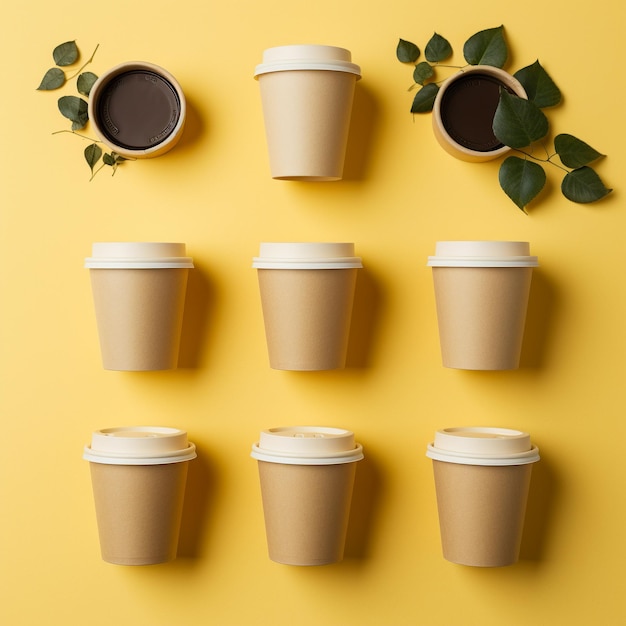
Where is `cup lid`? The width and height of the screenshot is (626, 626). cup lid is located at coordinates (476, 453), (292, 446), (136, 444), (489, 254), (288, 253), (163, 255), (304, 59).